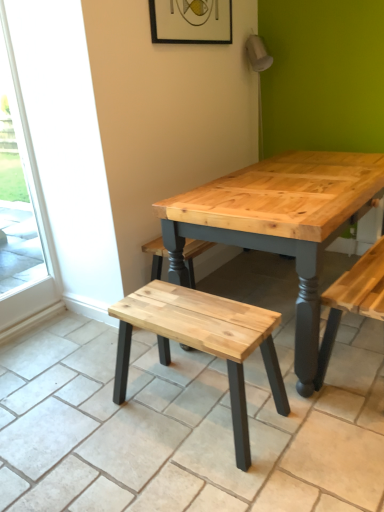
Question: Is natural wood stool at center wider than wooden frame at upper center?

Choices:
 (A) no
 (B) yes

Answer: (B)

Question: From the image's perspective, is natural wood stool at center under wooden frame at upper center?

Choices:
 (A) no
 (B) yes

Answer: (B)

Question: Would you say natural wood stool at center is a long distance from wooden frame at upper center?

Choices:
 (A) no
 (B) yes

Answer: (B)

Question: Can you confirm if natural wood stool at center is taller than wooden frame at upper center?

Choices:
 (A) no
 (B) yes

Answer: (B)

Question: Can you confirm if natural wood stool at center is bigger than wooden frame at upper center?

Choices:
 (A) no
 (B) yes

Answer: (B)

Question: Is wooden frame at upper center a part of natural wood stool at center?

Choices:
 (A) yes
 (B) no

Answer: (B)

Question: Is the position of wooden frame at upper center more distant than that of natural wood stool at center?

Choices:
 (A) no
 (B) yes

Answer: (B)

Question: Can you confirm if wooden frame at upper center is thinner than natural wood stool at center?

Choices:
 (A) no
 (B) yes

Answer: (B)

Question: Is wooden frame at upper center oriented towards natural wood stool at center?

Choices:
 (A) no
 (B) yes

Answer: (A)

Question: From the image's perspective, would you say wooden frame at upper center is positioned over natural wood stool at center?

Choices:
 (A) no
 (B) yes

Answer: (B)

Question: Does wooden frame at upper center have a lesser height compared to natural wood stool at center?

Choices:
 (A) no
 (B) yes

Answer: (B)

Question: Is wooden frame at upper center far away from natural wood stool at center?

Choices:
 (A) yes
 (B) no

Answer: (A)

Question: Could you tell me if transparent glass screen door at left is facing wooden frame at upper center?

Choices:
 (A) no
 (B) yes

Answer: (A)